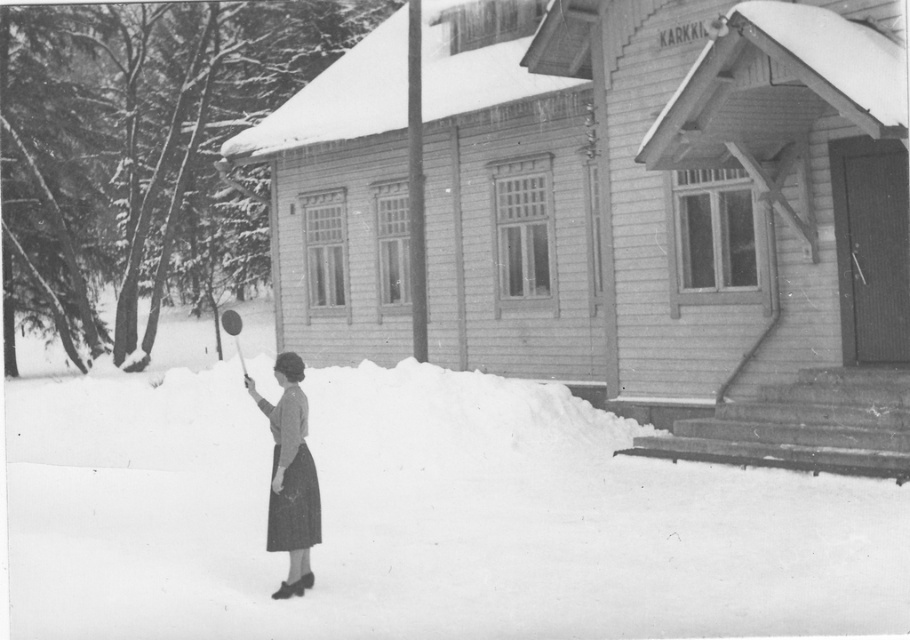
Question: Does white fluffy snow at lower left appear on the left side of smooth gray dress at lower left?

Choices:
 (A) yes
 (B) no

Answer: (A)

Question: Which of the following is the farthest from the observer?

Choices:
 (A) smooth gray dress at lower left
 (B) white fluffy snow at lower left

Answer: (A)

Question: Can you confirm if white fluffy snow at lower left is wider than smooth gray dress at lower left?

Choices:
 (A) no
 (B) yes

Answer: (B)

Question: Which point is farther from the camera taking this photo?

Choices:
 (A) (130, 637)
 (B) (281, 509)

Answer: (B)

Question: Is white fluffy snow at lower left closer to the viewer compared to smooth gray dress at lower left?

Choices:
 (A) yes
 (B) no

Answer: (A)

Question: Among these objects, which one is nearest to the camera?

Choices:
 (A) white fluffy snow at lower left
 (B) smooth gray dress at lower left

Answer: (A)